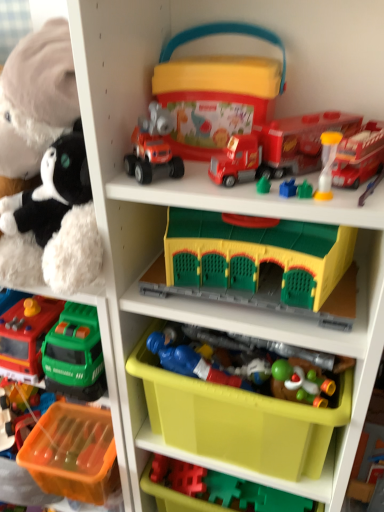
Question: From a real-world perspective, is orange plastic storage box at lower left, placed as the third storage box when sorted from top to bottom, physically below blue plastic toy soldier at center, which is counted as the fourth toy, starting from the bottom?

Choices:
 (A) yes
 (B) no

Answer: (A)

Question: Could you tell me if orange plastic storage box at lower left, placed as the third storage box when sorted from top to bottom, is facing blue plastic toy soldier at center, the 7th toy in the top-to-bottom sequence?

Choices:
 (A) yes
 (B) no

Answer: (B)

Question: Is orange plastic storage box at lower left, placed as the third storage box when sorted from top to bottom, not near blue plastic toy soldier at center, which is counted as the fourth toy, starting from the bottom?

Choices:
 (A) yes
 (B) no

Answer: (B)

Question: From the image's perspective, would you say orange plastic storage box at lower left, placed as the third storage box when sorted from top to bottom, is shown under blue plastic toy soldier at center, which is counted as the fourth toy, starting from the bottom?

Choices:
 (A) yes
 (B) no

Answer: (A)

Question: Is orange plastic storage box at lower left, placed as the third storage box when sorted from top to bottom, not within blue plastic toy soldier at center, the 7th toy in the top-to-bottom sequence?

Choices:
 (A) no
 (B) yes

Answer: (B)

Question: Is orange plastic storage box at lower left, placed as the third storage box when sorted from top to bottom, at the left side of blue plastic toy soldier at center, the 7th toy in the top-to-bottom sequence?

Choices:
 (A) yes
 (B) no

Answer: (A)

Question: Are yellow plastic building at center, the 6th toy positioned from the top, and translucent yellow hourglass at upper right, which is counted as the 7th toy, starting from the bottom, located far from each other?

Choices:
 (A) yes
 (B) no

Answer: (B)

Question: Does yellow plastic building at center, the 6th toy positioned from the top, contain translucent yellow hourglass at upper right, which is the fourth toy from top to bottom?

Choices:
 (A) yes
 (B) no

Answer: (B)

Question: Is yellow plastic building at center, the 6th toy positioned from the top, bigger than translucent yellow hourglass at upper right, which is the fourth toy from top to bottom?

Choices:
 (A) no
 (B) yes

Answer: (B)

Question: From a real-world perspective, is yellow plastic building at center, the 6th toy positioned from the top, on translucent yellow hourglass at upper right, which is counted as the 7th toy, starting from the bottom?

Choices:
 (A) yes
 (B) no

Answer: (B)

Question: Can you confirm if yellow plastic building at center, the 5th toy when ordered from bottom to top, is wider than translucent yellow hourglass at upper right, which is counted as the 7th toy, starting from the bottom?

Choices:
 (A) no
 (B) yes

Answer: (B)

Question: Is yellow plastic building at center, the 5th toy when ordered from bottom to top, thinner than translucent yellow hourglass at upper right, which is the fourth toy from top to bottom?

Choices:
 (A) yes
 (B) no

Answer: (B)

Question: Can we say orange plastic storage box at lower left, placed as the third storage box when sorted from top to bottom, lies outside translucent yellow hourglass at upper right, which appears as the 5th toy when viewed from the top?

Choices:
 (A) no
 (B) yes

Answer: (B)